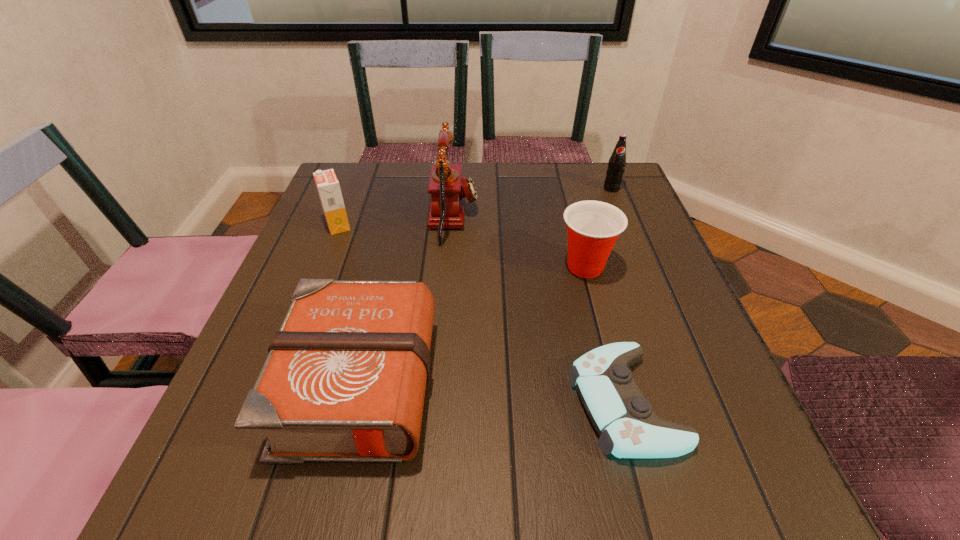
The width and height of the screenshot is (960, 540). I want to click on the tallest object, so click(447, 205).

Locate an element on the screen. This screenshot has width=960, height=540. the rightmost object is located at coordinates (616, 166).

Identify the location of orange juice. The width and height of the screenshot is (960, 540). (328, 187).

This screenshot has height=540, width=960. I want to click on cup, so click(593, 227).

Find the location of a particular element. The height and width of the screenshot is (540, 960). Bible is located at coordinates (344, 380).

Where is `control`? The height and width of the screenshot is (540, 960). control is located at coordinates point(628,428).

At what (x,y) coordinates should I click in order to perform the action: click on vacant area located on the dial of the tallest object. Please return your answer as a coordinate pair (x, y). This screenshot has width=960, height=540. Looking at the image, I should click on (544, 218).

Identify the location of vacant region located 0.370m on the front label of the rightmost object. Image resolution: width=960 pixels, height=540 pixels. (655, 295).

I want to click on vacant area located 0.080m on the front of the orange juice, so click(x=325, y=258).

Where is `vacant area situated 0.240m on the back of the cup`? The width and height of the screenshot is (960, 540). vacant area situated 0.240m on the back of the cup is located at coordinates (565, 190).